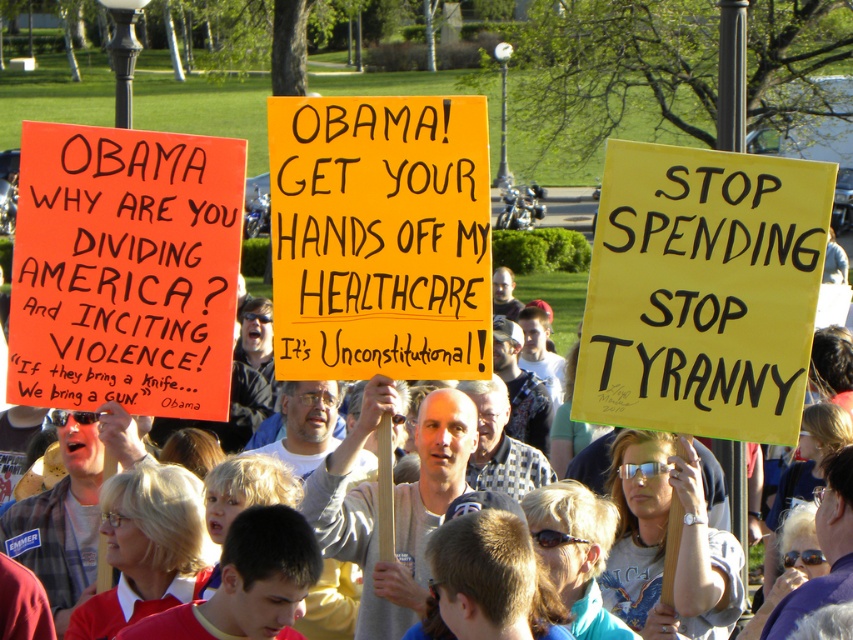
What do you see at coordinates (125, 269) in the screenshot? The height and width of the screenshot is (640, 853). I see `orange cardboard sign at left` at bounding box center [125, 269].

Identify the location of orange cardboard sign at left. (125, 269).

Which of these two, yellow paper sign at right or orange paper sign at center, stands shorter?

With less height is orange paper sign at center.

Is yellow paper sign at right closer to the viewer compared to orange paper sign at center?

That is False.

Does point (798, 378) lie behind point (456, 368)?

No, it is not.

The image size is (853, 640). In order to click on yellow paper sign at right in this screenshot , I will do `click(701, 291)`.

Which is behind, point (679, 259) or point (146, 257)?

The point (146, 257) is behind.

Is point (596, 362) positioned after point (91, 392)?

No, (596, 362) is closer to viewer.

Is point (636, 179) positioned before point (71, 241)?

Yes.

The image size is (853, 640). I want to click on yellow paper sign at right, so click(x=701, y=291).